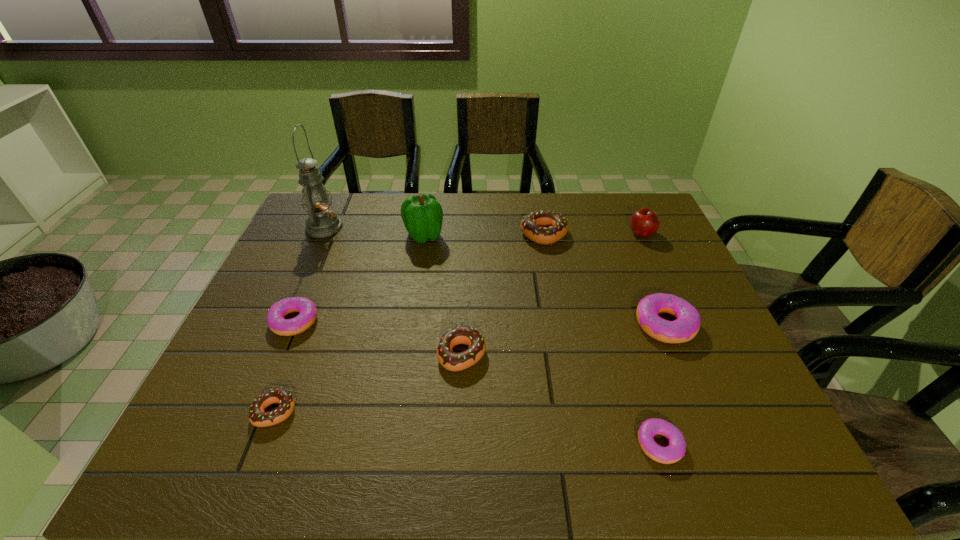
Where is `vacant region located on the back of the biggest pink doughnut`? vacant region located on the back of the biggest pink doughnut is located at coordinates (622, 219).

The image size is (960, 540). Identify the location of vacant point located on the back of the fifth object from left to right. pos(464,296).

Locate an element on the screen. The image size is (960, 540). vacant space located on the right of the second smallest pink doughnut is located at coordinates (362, 321).

In order to click on vacant area situated 0.320m on the back of the leftmost brown doughnut in this screenshot , I will do `click(321, 292)`.

The height and width of the screenshot is (540, 960). I want to click on vacant area situated on the back of the nearest pink doughnut, so click(621, 323).

Where is `oil lamp that is at the far edge`? The width and height of the screenshot is (960, 540). oil lamp that is at the far edge is located at coordinates (322, 222).

Find the location of `bell pepper at the far edge`. bell pepper at the far edge is located at coordinates (422, 214).

The height and width of the screenshot is (540, 960). Identify the location of apple positioned at the far edge. (644, 222).

Locate an element on the screen. doughnut that is at the far edge is located at coordinates (543, 227).

Image resolution: width=960 pixels, height=540 pixels. I want to click on oil lamp present at the left edge, so click(x=322, y=222).